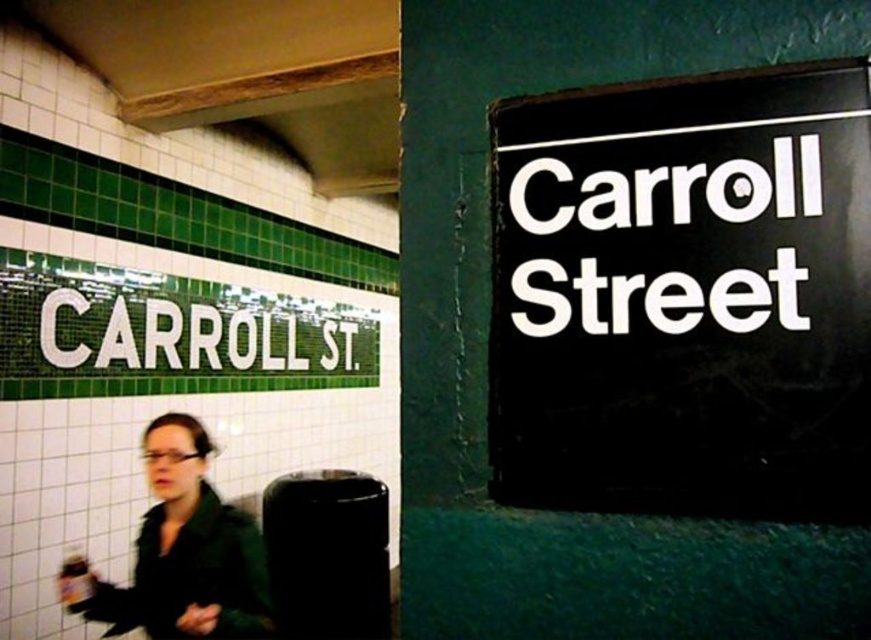
Question: Does black plastic sign at upper right appear on the left side of green matte jacket at lower left?

Choices:
 (A) no
 (B) yes

Answer: (A)

Question: Observing the image, what is the correct spatial positioning of black plastic sign at upper right in reference to green matte jacket at lower left?

Choices:
 (A) right
 (B) left

Answer: (A)

Question: Which of the following is the farthest from the observer?

Choices:
 (A) green matte jacket at lower left
 (B) black plastic sign at upper right

Answer: (A)

Question: Does black plastic sign at upper right appear over green matte jacket at lower left?

Choices:
 (A) yes
 (B) no

Answer: (A)

Question: Which point is closer to the camera?

Choices:
 (A) (701, 161)
 (B) (186, 481)

Answer: (A)